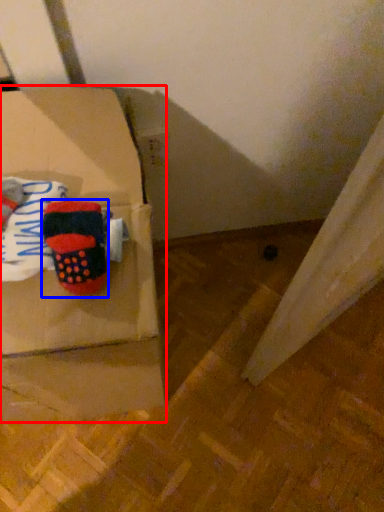
Question: Among these objects, which one is nearest to the camera, box (highlighted by a red box) or footwear (highlighted by a blue box)?

Choices:
 (A) box
 (B) footwear

Answer: (A)